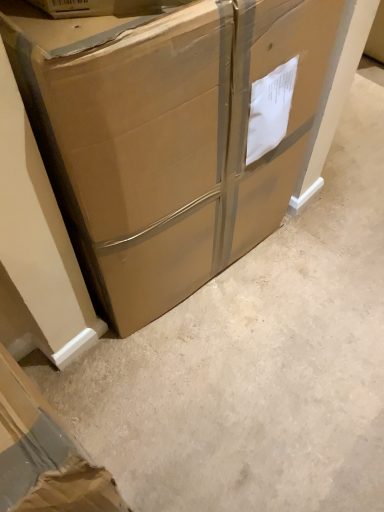
Locate an element on the screen. This screenshot has width=384, height=512. free location to the right of brown cardboard box at center is located at coordinates (323, 258).